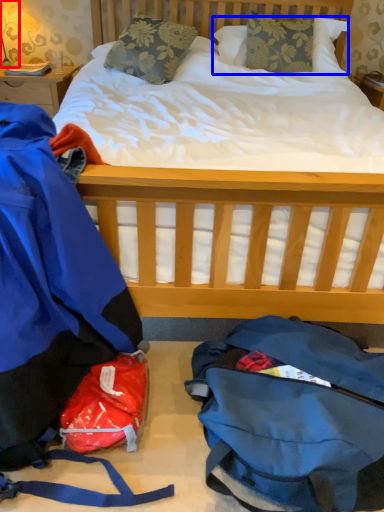
Question: Which of the following is the closest to the observer, lamp (highlighted by a red box) or pillow (highlighted by a blue box)?

Choices:
 (A) lamp
 (B) pillow

Answer: (B)